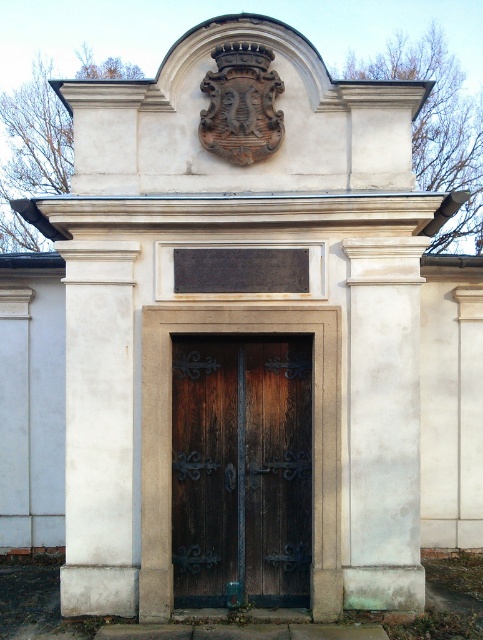
The image size is (483, 640). What do you see at coordinates (383, 422) in the screenshot? I see `white stone column at right` at bounding box center [383, 422].

Measure the distance between point (415,252) and camera.

Point (415,252) and camera are 7.98 meters apart.

Locate an element on the screen. The height and width of the screenshot is (640, 483). white stone column at right is located at coordinates (383, 422).

Can you confirm if dark wood door at center is thinner than white stone column at right?

No.

Locate an element on the screen. This screenshot has width=483, height=640. dark wood door at center is located at coordinates (241, 470).

Is dark wood door at center to the left of white stone column at left from the viewer's perspective?

No, dark wood door at center is not to the left of white stone column at left.

Can you confirm if dark wood door at center is wider than white stone column at left?

Indeed, dark wood door at center has a greater width compared to white stone column at left.

Is point (176, 364) farther from camera compared to point (124, 422)?

That is True.

Locate an element on the screen. The image size is (483, 640). dark wood door at center is located at coordinates click(x=241, y=470).